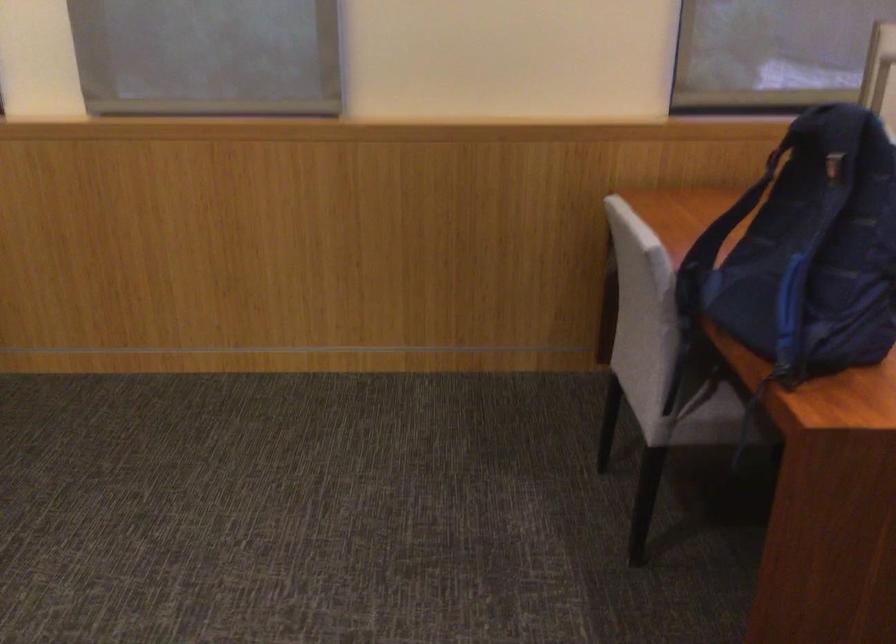
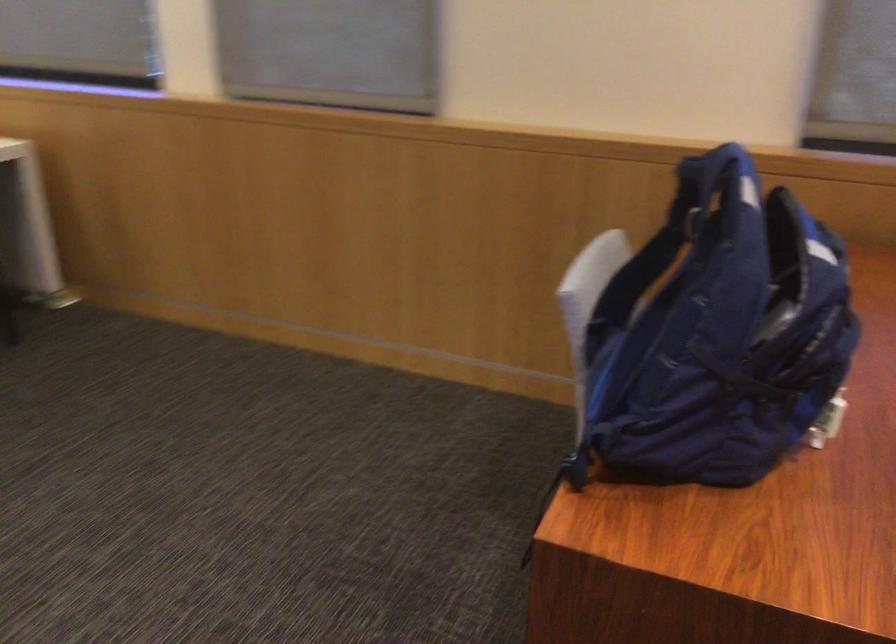
Locate, in the second image, the point that corresponds to (x=727, y=228) in the first image.

(645, 285)